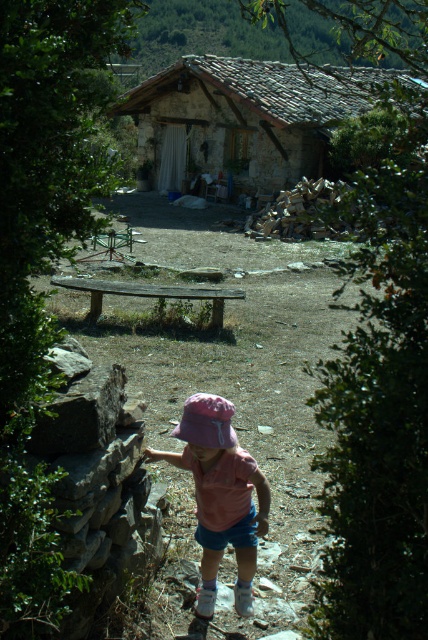
Consider the image. You are standing at the position of the small child wearing a pink hat in the scene. You want to walk directly towards the rustic stone hut at center. In which direction should you move relative to your current position?

Since the rustic stone hut at center is located at point (243, 116) in the image, you should move forward and slightly to the right from your current position to head directly towards it.

You are a photographer trying to capture the rustic stone hut at center and the pink fabric hat at center in the same frame. Which object should you focus on first to ensure both are in the frame?

The rustic stone hut at center is taller than the pink fabric hat at center, so you should focus on the rustic stone hut at center first to ensure both are in the frame.

You are standing at the position of the point marked at (219, 496). Looking around, you see the pink fabric hat at center. Which direction should you walk to reach the stone house with the open doorway in the background?

The stone house with the open doorway is in the background, so you should walk forward from the point marked at (219, 496) to reach it.